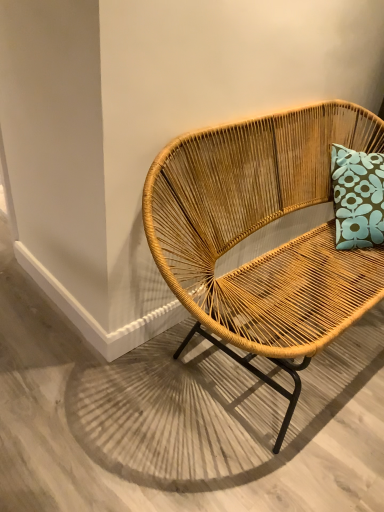
Question: Are natural woven chair at center and natural wood chair at center beside each other?

Choices:
 (A) yes
 (B) no

Answer: (B)

Question: Does natural woven chair at center come behind natural wood chair at center?

Choices:
 (A) yes
 (B) no

Answer: (B)

Question: Is natural woven chair at center far away from natural wood chair at center?

Choices:
 (A) no
 (B) yes

Answer: (A)

Question: Is the depth of natural woven chair at center less than that of natural wood chair at center?

Choices:
 (A) no
 (B) yes

Answer: (B)

Question: From the image's perspective, would you say natural woven chair at center is shown under natural wood chair at center?

Choices:
 (A) no
 (B) yes

Answer: (A)

Question: From the image's perspective, does natural woven chair at center appear higher than natural wood chair at center?

Choices:
 (A) no
 (B) yes

Answer: (B)

Question: Can you confirm if natural wood chair at center is bigger than natural woven chair at center?

Choices:
 (A) no
 (B) yes

Answer: (A)

Question: From the image's perspective, is natural wood chair at center over natural woven chair at center?

Choices:
 (A) no
 (B) yes

Answer: (A)

Question: Is natural wood chair at center to the right of natural woven chair at center from the viewer's perspective?

Choices:
 (A) no
 (B) yes

Answer: (A)

Question: Can you confirm if natural wood chair at center is wider than natural woven chair at center?

Choices:
 (A) no
 (B) yes

Answer: (B)

Question: Is natural wood chair at center smaller than natural woven chair at center?

Choices:
 (A) no
 (B) yes

Answer: (B)

Question: Is natural wood chair at center shorter than natural woven chair at center?

Choices:
 (A) yes
 (B) no

Answer: (A)

Question: Considering the positions of natural woven chair at center and natural wood chair at center in the image, is natural woven chair at center wider or thinner than natural wood chair at center?

Choices:
 (A) wide
 (B) thin

Answer: (B)